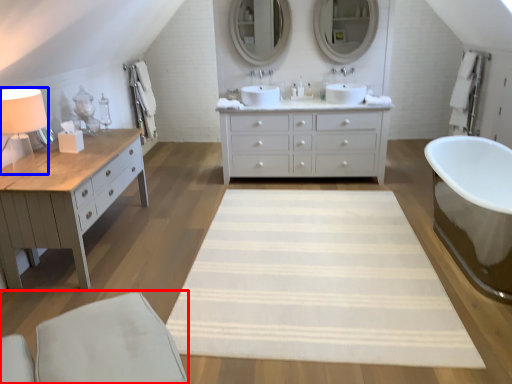
Question: Among these objects, which one is nearest to the camera, swivel chair (highlighted by a red box) or table lamp (highlighted by a blue box)?

Choices:
 (A) swivel chair
 (B) table lamp

Answer: (A)